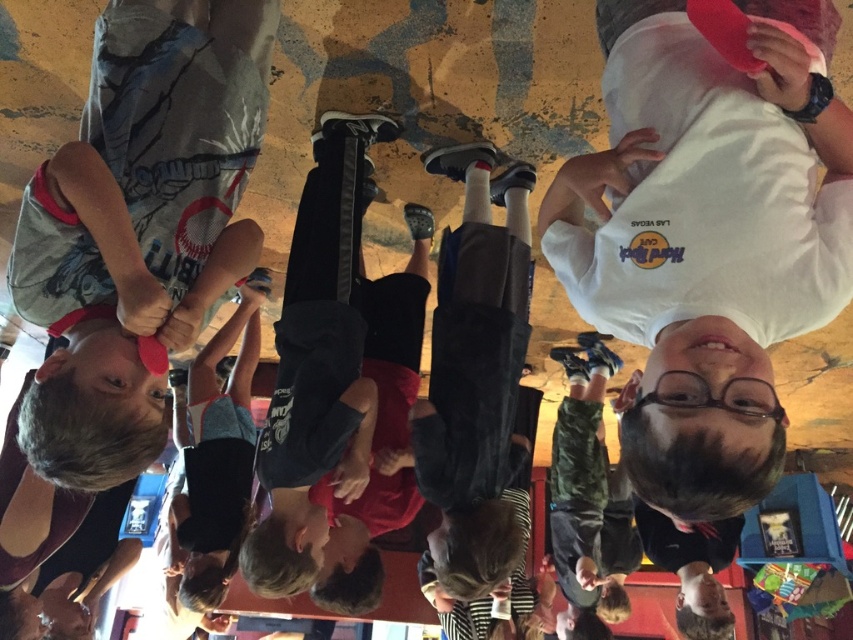
You are a photographer trying to adjust the camera focus. You need to focus on the dark gray pants at center and camouflage pants at lower right. Which one is closer to the camera?

The dark gray pants at center is shorter than camouflage pants at lower right, so it is closer to the camera.

You are a photographer adjusting your camera settings to focus on two specific points in the image. The first point is labeled as point [467,189] and the second is point [593,401]. Since you want to ensure both points are in focus, which point should you prioritize focusing on first to account for depth of field?

You should prioritize focusing on point [467,189] first because it is closer to the camera than point [593,401], ensuring that the depth of field will cover both points more effectively when focusing on the closer one.

You are a photographer trying to capture a closeup of the dark gray pants at center and the camouflage pants at lower right. Which pair of pants would require you to move closer to get a clear shot?

The dark gray pants at center is thinner than camouflage pants at lower right, so you would need to move closer to the dark gray pants at center to capture a clear shot.